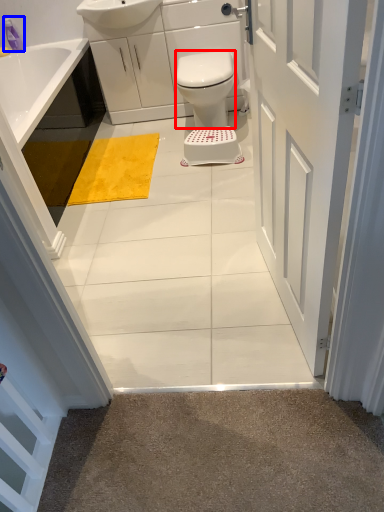
Question: Which object appears farthest to the camera in this image, bidet (highlighted by a red box) or toiletry (highlighted by a blue box)?

Choices:
 (A) bidet
 (B) toiletry

Answer: (B)